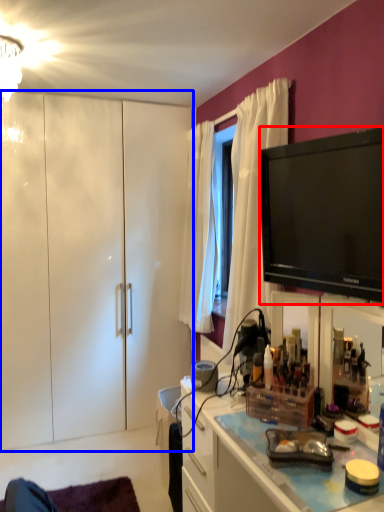
Question: Which of the following is the closest to the observer, television (highlighted by a red box) or cabinetry (highlighted by a blue box)?

Choices:
 (A) television
 (B) cabinetry

Answer: (A)